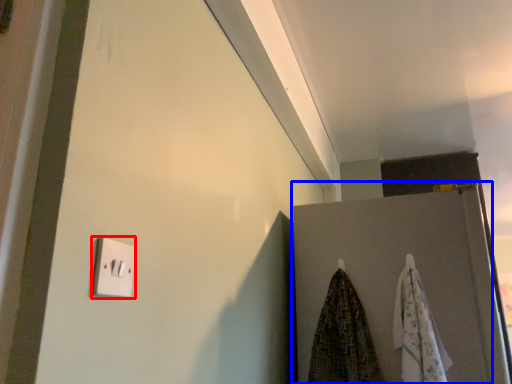
Question: Which object is closer to the camera taking this photo, light switch (highlighted by a red box) or door (highlighted by a blue box)?

Choices:
 (A) light switch
 (B) door

Answer: (A)